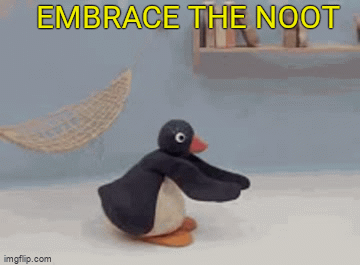
Identify the location of floor. (58, 228).